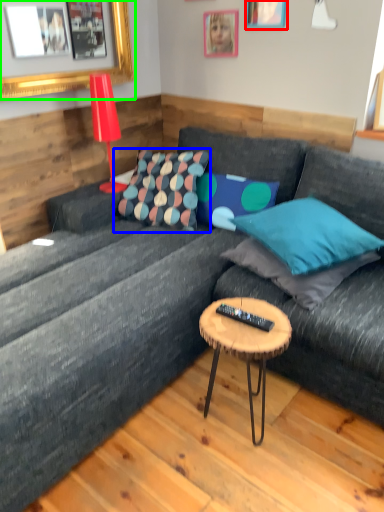
Question: Which is nearer to the picture frame (highlighted by a red box)? pillow (highlighted by a blue box) or picture frame (highlighted by a green box).

Choices:
 (A) pillow
 (B) picture frame

Answer: (B)